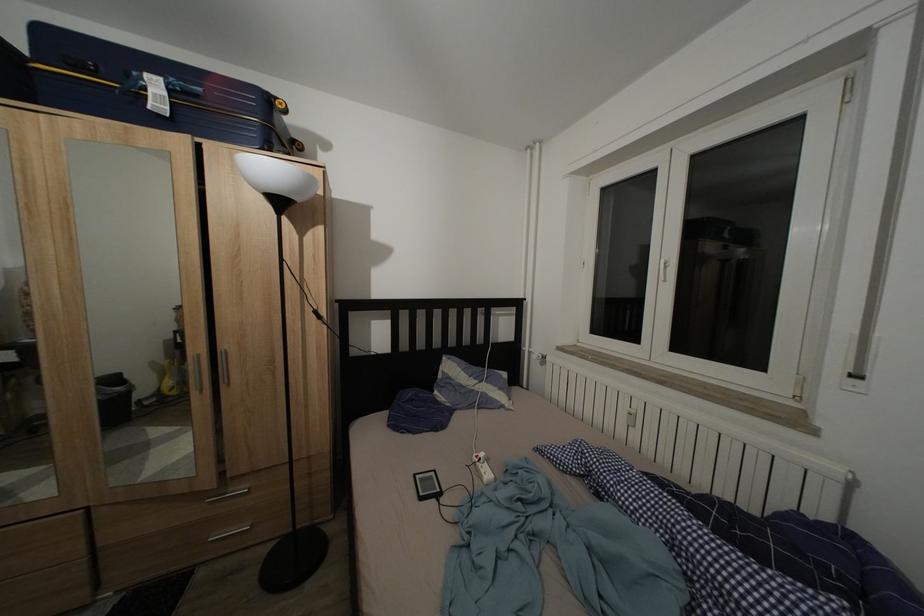
What do you see at coordinates (663, 270) in the screenshot?
I see `the white window handle` at bounding box center [663, 270].